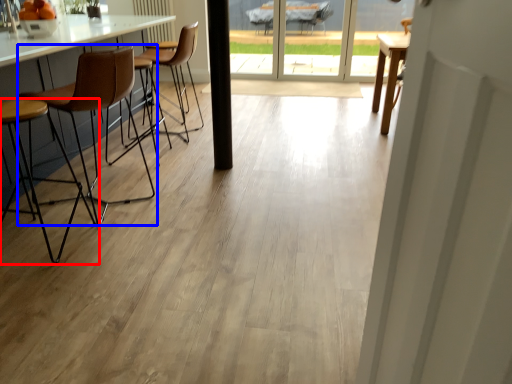
Question: Among these objects, which one is farthest to the camera, chair (highlighted by a red box) or chair (highlighted by a blue box)?

Choices:
 (A) chair
 (B) chair

Answer: (B)